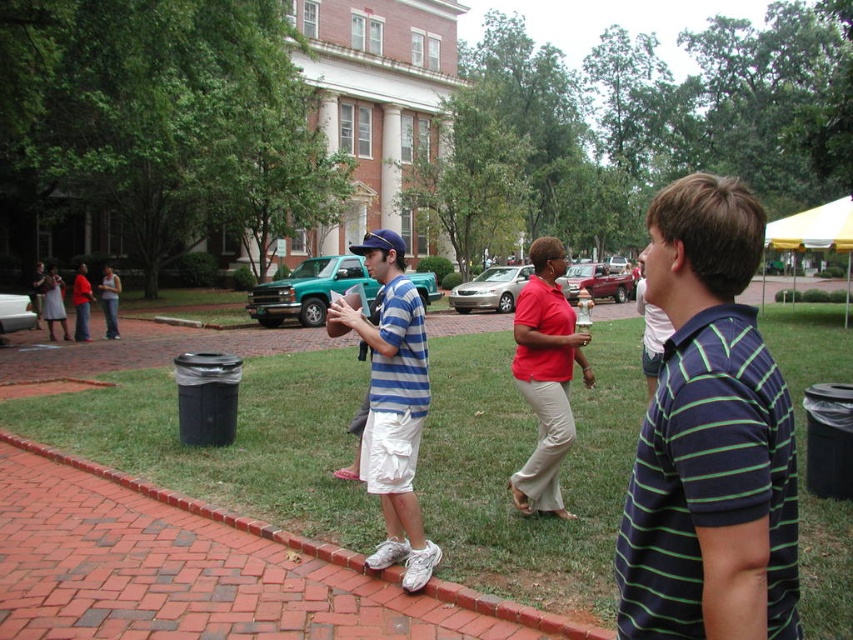
You are trying to decide which item to grab first from the scene. Based on their sizes, which item is narrower between the dark blue striped polo shirt at center and the blue fabric baseball cap at center?

The dark blue striped polo shirt at center is thinner than the blue fabric baseball cap at center, so the dark blue striped polo shirt at center is narrower.

You are at an event and see two people in the center of the image wearing a dark blue striped polo shirt at center and a blue fabric baseball cap at center. Which one is closer to you?

The dark blue striped polo shirt at center is closer to you because it is in front of the blue fabric baseball cap at center.

Based on the photo, you are at the community event and want to greet the person wearing the striped cotton shirt at center and the striped polo shirt at center. Which one is closer to the ground?

The striped cotton shirt at center is located below striped polo shirt at center, so the striped cotton shirt at center is closer to the ground.